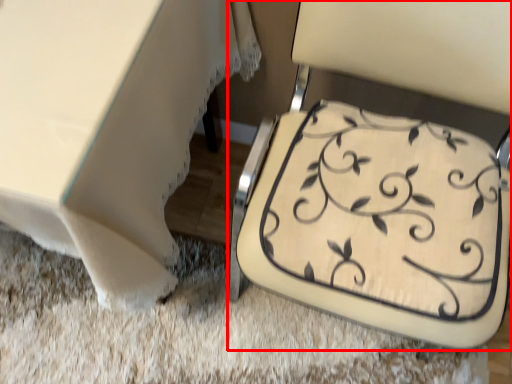
Question: From the image's perspective, where is chair (annotated by the red box) located in relation to table in the image?

Choices:
 (A) above
 (B) below

Answer: (B)